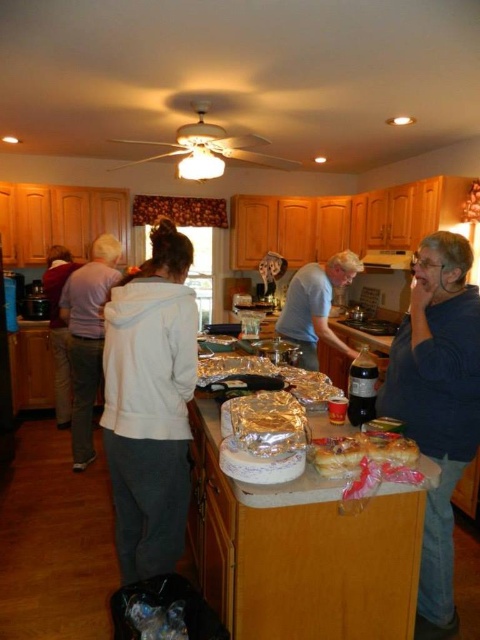
You are standing at the counter in the kitchen and want to place a new item between the two points labeled as point (305, 321) and point (48, 291). Which point should you place it closer to in order to be between them?

To place the item between point (305, 321) and point (48, 291), you should place it closer to point (48, 291) because point (305, 321) is in front of point (48, 291).